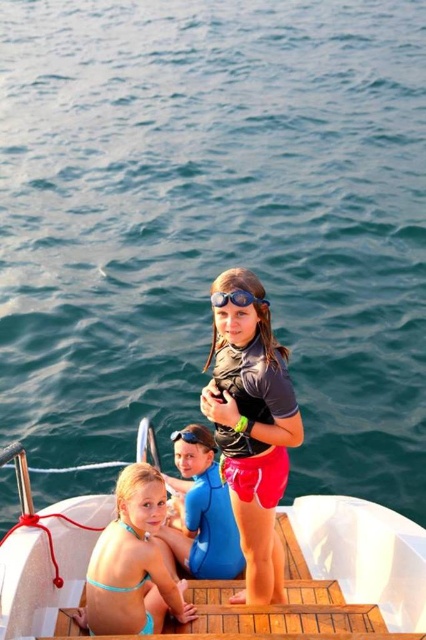
Who is shorter, wooden at center or transparent blue goggles at upper center?

transparent blue goggles at upper center

Does wooden at center lie in front of transparent blue goggles at upper center?

Yes, it is.

Which is behind, point (190, 600) or point (187, 436)?

Point (187, 436)

I want to click on wooden at center, so click(279, 611).

Is light blue bikini at lower left thinner than transparent blue goggles at upper center?

No.

Does light blue bikini at lower left have a larger size compared to transparent blue goggles at upper center?

Yes.

Describe the element at coordinates (132, 563) in the screenshot. This screenshot has width=426, height=640. I see `light blue bikini at lower left` at that location.

Identify the location of light blue bikini at lower left. (132, 563).

Looking at this image, does light blue bikini at lower left come behind blue neoprene wetsuit at center?

That is False.

The height and width of the screenshot is (640, 426). I want to click on light blue bikini at lower left, so click(x=132, y=563).